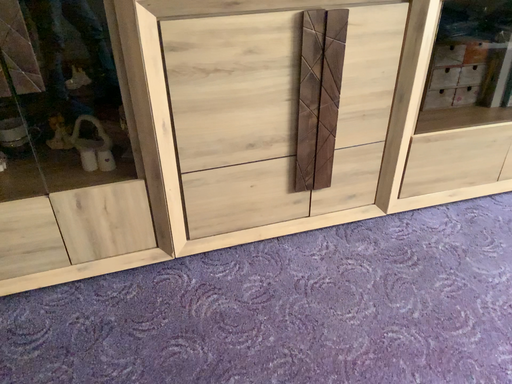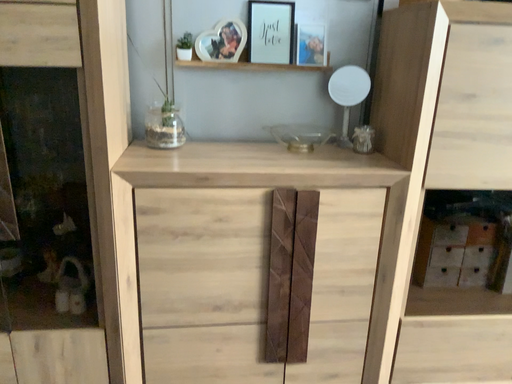
Question: Which way did the camera rotate in the video?

Choices:
 (A) rotated left
 (B) rotated right

Answer: (A)